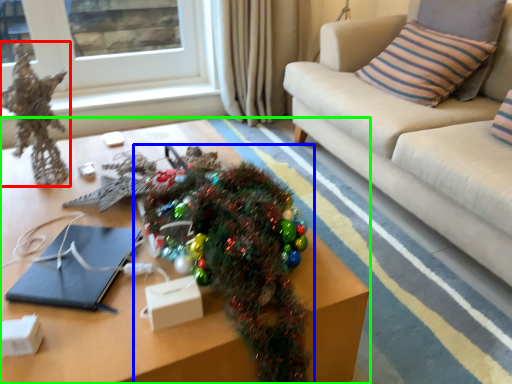
Question: Estimate the real-world distances between objects in this image. Which object is closer to decor (highlighted by a red box), christmas tree (highlighted by a blue box) or table (highlighted by a green box)?

Choices:
 (A) christmas tree
 (B) table

Answer: (B)